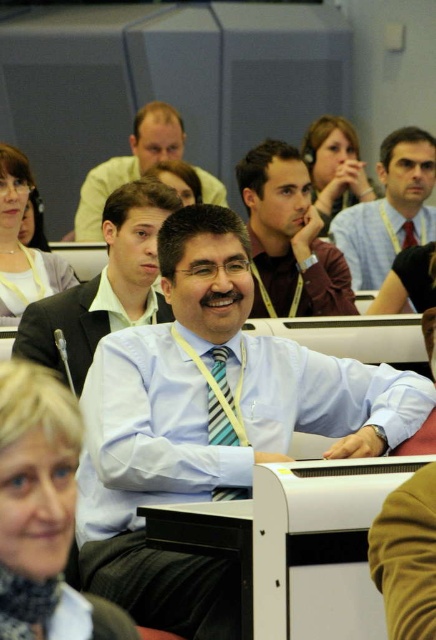
Question: Which point is farther to the camera?

Choices:
 (A) (408, 237)
 (B) (200, 291)
 (C) (218, 200)
 (D) (320, 228)

Answer: (C)

Question: Which object is positioned closest to the white glossy shirt at center?

Choices:
 (A) matte black shirt at center
 (B) yellow striped tie at center

Answer: (A)

Question: Which point is closer to the camera?

Choices:
 (A) striped fabric tie at center
 (B) matte black shirt at center

Answer: (A)

Question: Can you confirm if matte black shirt at center is wider than striped fabric tie at center?

Choices:
 (A) no
 (B) yes

Answer: (B)

Question: Does light brown leather jacket at upper center appear on the right side of striped fabric tie at center?

Choices:
 (A) no
 (B) yes

Answer: (B)

Question: Is light brown leather jacket at upper center smaller than yellow striped tie at center?

Choices:
 (A) yes
 (B) no

Answer: (B)